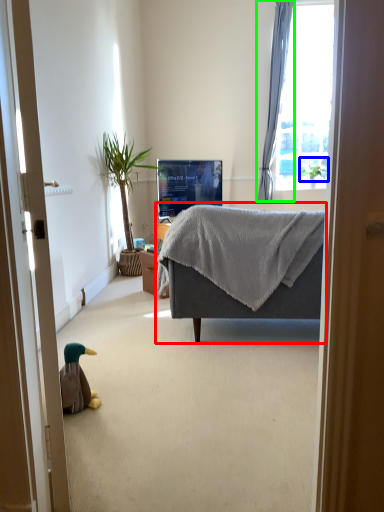
Question: Which object is positioned closest to studio couch (highlighted by a red box)? Select from plant (highlighted by a blue box) and curtain (highlighted by a green box).

Choices:
 (A) plant
 (B) curtain

Answer: (A)